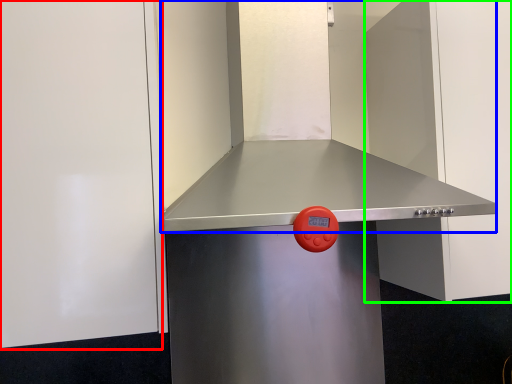
Question: Which is nearer to the door (highlighted by a red box)? vent (highlighted by a blue box) or door (highlighted by a green box).

Choices:
 (A) vent
 (B) door

Answer: (A)